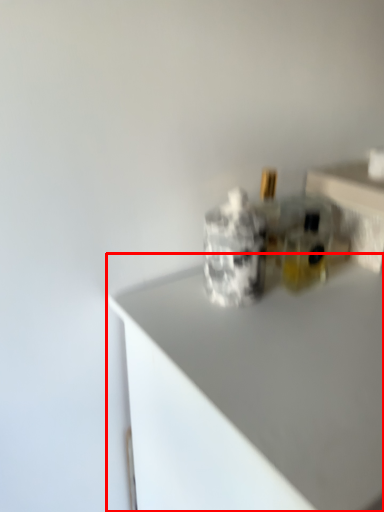
Question: In this image, where is countertop (annotated by the red box) located relative to table?

Choices:
 (A) left
 (B) right

Answer: (A)